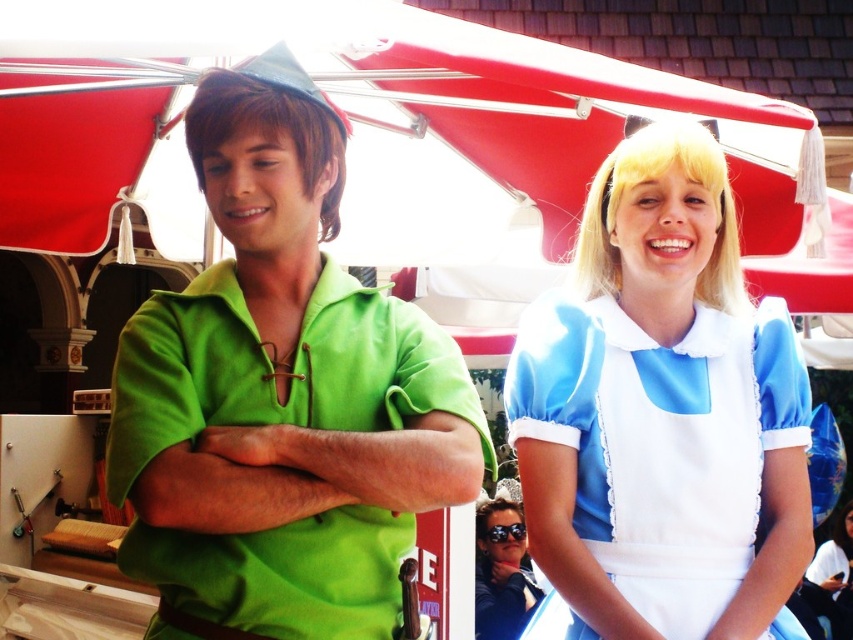
You are standing in front of the two costumed individuals under the red canopy tent. You need to place a small accessory exactly at the position of the matte blue dress at center. According to the coordinates provided, where should you place it?

The matte blue dress at center is located at point (x=281, y=394), so you should place the accessory at those coordinates.

You are organizing a costume party and need to arrange two dresses in a display case. The matte blue dress at center and the blue satin dress at right must be placed side by side. Based on the image, which dress should you place on the left side to ensure they both fit comfortably?

The matte blue dress at center is wider than the blue satin dress at right, so placing the wider matte blue dress at center on the left will allow both dresses to fit comfortably in the display case.

You are at a costume party and want to take a photo with the blue satin dress at right and the sunglasses at center. If you stand facing the two people, which object is closer to the right edge of the photo?

The blue satin dress at right is closer to the right edge of the photo because it is positioned to the right of the sunglasses at center.